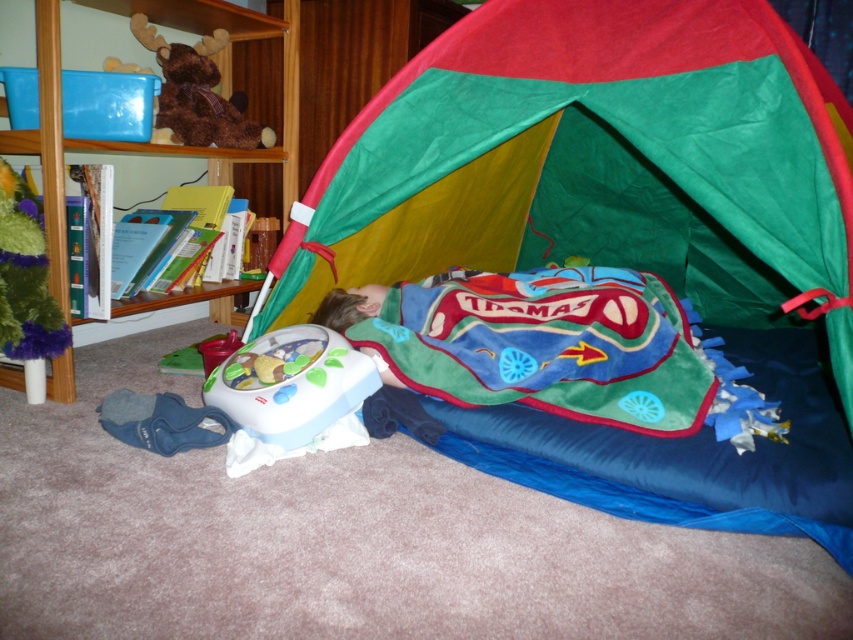
You are a parent checking on your child. You see the multicolored fabric tent at center and the brown plush bear at upper left. Which object is taller?

The multicolored fabric tent at center is taller than the brown plush bear at upper left.

You are a parent trying to place a new toy box in the room. The toy box has coordinates at point 0.25, 0.20. Is the wooden bookshelf at upper left located to the north or south of the toy box?

The wooden bookshelf at upper left is located at point (151, 144), which is north of the toy box at (170, 160) because the y coordinate is smaller.

You are a child who wants to play with the fuzzy green plush at upper left and the brown plush bear at upper left. Which one can you pick up more easily if you are sitting on the tent?

The fuzzy green plush at upper left can be picked up more easily since it has a smaller size compared to the brown plush bear at upper left.